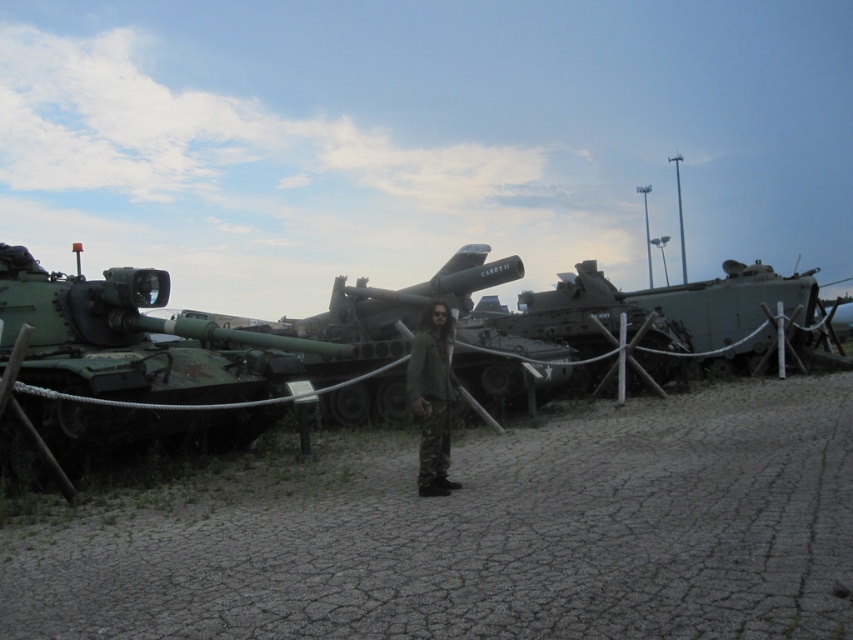
In the outdoor military vehicle display, where exactly is the green matte tank at left located in terms of coordinates?

The green matte tank at left is located at coordinates point (119, 339).

You are a photographer trying to capture the green matte tank at center from a specific angle. If you position yourself at the coordinates given in the description, will you be able to see the tank clearly without any obstructions?

The green matte tank at center is located at point (390, 310), so positioning yourself there would place you directly at the tank, meaning you can see it clearly without any obstructions.